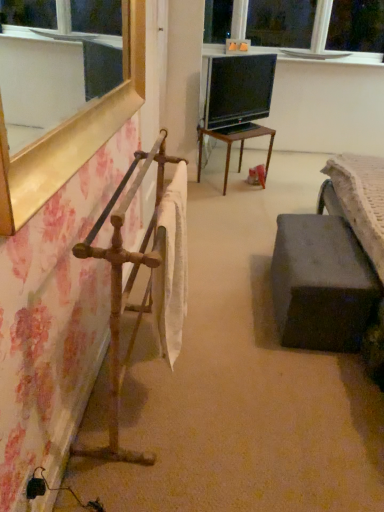
You are a GUI agent. You are given a task and a screenshot of the screen. Output one action in this format:
    pyautogui.click(x=<x>, y=<y>)
    Task: Click on the vacant point to the right of rusty metal towel rack at left
    This screenshot has height=512, width=384.
    Given the screenshot: What is the action you would take?
    pyautogui.click(x=257, y=386)